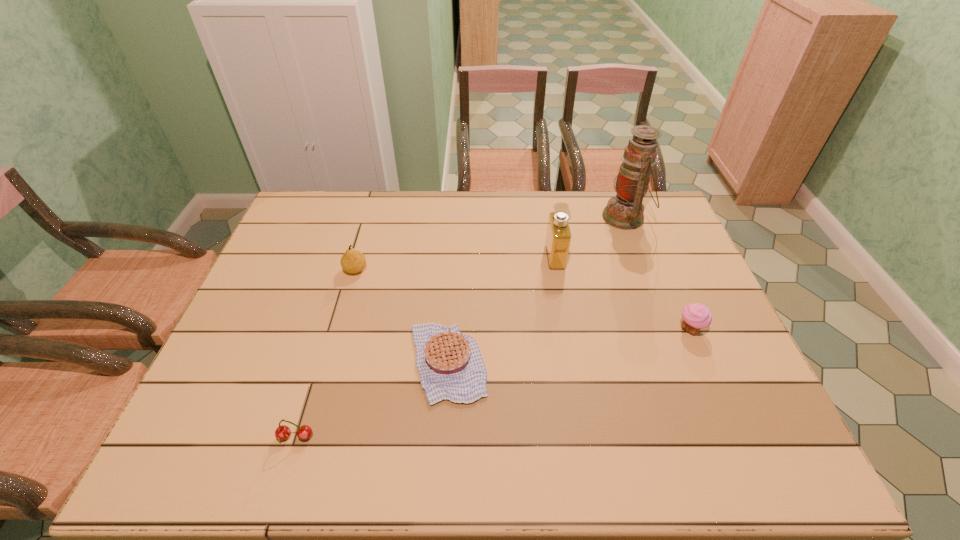
Find the location of a particular element. Image resolution: width=960 pixels, height=540 pixels. object at the far right corner is located at coordinates (624, 211).

In the image, there is a desktop. At what (x,y) coordinates should I click in order to perform the action: click on vacant space at the far edge. Please return your answer as a coordinate pair (x, y). The height and width of the screenshot is (540, 960). Looking at the image, I should click on 344,221.

The height and width of the screenshot is (540, 960). Identify the location of vacant region at the near edge of the desktop. (449, 440).

At what (x,y) coordinates should I click in order to perform the action: click on free space at the left edge. Please return your answer as a coordinate pair (x, y). This screenshot has width=960, height=540. Looking at the image, I should click on (235, 383).

At what (x,y) coordinates should I click in order to perform the action: click on vacant space at the right edge of the desktop. Please return your answer as a coordinate pair (x, y). The width and height of the screenshot is (960, 540). Looking at the image, I should click on (660, 237).

This screenshot has width=960, height=540. I want to click on vacant area at the far left corner, so click(x=331, y=205).

Find the location of a particular element. blank space at the near left corner is located at coordinates (223, 471).

The height and width of the screenshot is (540, 960). In order to click on free space that is in between the tallest object and the third object from left to right in this screenshot , I will do `click(537, 290)`.

You are a GUI agent. You are given a task and a screenshot of the screen. Output one action in this format:
    pyautogui.click(x=<x>, y=<y>)
    Task: Click on the free space between the third object from left to right and the tallest object
    
    Given the screenshot: What is the action you would take?
    pyautogui.click(x=537, y=290)

Locate an element on the screen. The image size is (960, 540). vacant point located between the cupcake and the cherry is located at coordinates (492, 383).